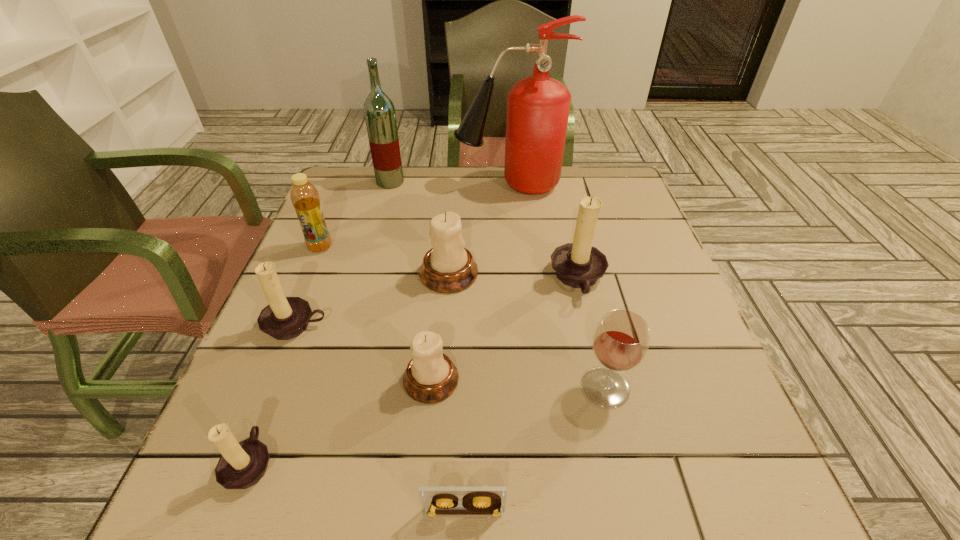
Find the location of a particular element. fire extinguisher situated at the far edge is located at coordinates point(538,107).

The height and width of the screenshot is (540, 960). In order to click on liquor that is positioned at the far edge in this screenshot , I will do `click(379, 111)`.

Image resolution: width=960 pixels, height=540 pixels. I want to click on candle holder that is at the near edge, so click(242, 465).

Image resolution: width=960 pixels, height=540 pixels. What are the coordinates of `videotape that is at the near edge` in the screenshot? It's located at (436, 500).

You are a GUI agent. You are given a task and a screenshot of the screen. Output one action in this format:
    pyautogui.click(x=<x>, y=<y>)
    Task: Click on the liquor that is at the left edge
    The image size is (960, 540).
    Given the screenshot: What is the action you would take?
    pyautogui.click(x=379, y=111)

The image size is (960, 540). Find the location of `bottle present at the left edge`. bottle present at the left edge is located at coordinates (304, 196).

At what (x,y) coordinates should I click in order to perform the action: click on object situated at the right edge. Please return your answer as a coordinate pair (x, y). Looking at the image, I should click on (579, 265).

Where is `object located in the far left corner section of the desktop`? This screenshot has height=540, width=960. object located in the far left corner section of the desktop is located at coordinates (379, 111).

Where is `object present at the near left corner`? The width and height of the screenshot is (960, 540). object present at the near left corner is located at coordinates (242, 465).

Identify the location of vacant space at the far edge of the desktop. Image resolution: width=960 pixels, height=540 pixels. tap(539, 197).